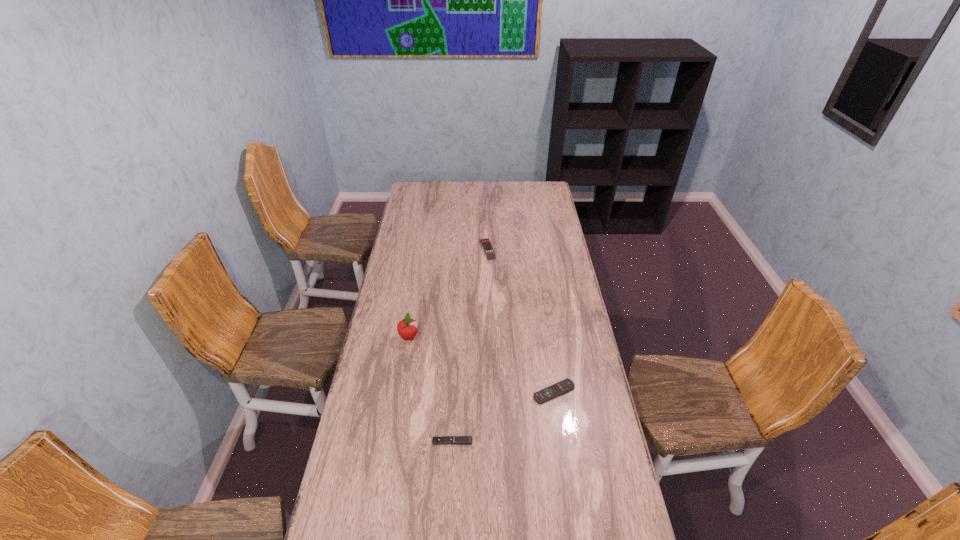
I want to click on the tallest object, so click(407, 328).

Locate an element on the screen. This screenshot has height=540, width=960. the second farthest object is located at coordinates (407, 328).

Identify the location of the farthest object. (485, 242).

At what (x,y) coordinates should I click in order to perform the action: click on the farthest remote control. Please return your answer as a coordinate pair (x, y). The width and height of the screenshot is (960, 540). Looking at the image, I should click on (485, 242).

Identify the location of the nearest remote control. This screenshot has width=960, height=540. (460, 440).

At what (x,y) coordinates should I click in order to perform the action: click on the second object from left to right. Please return your answer as a coordinate pair (x, y). The height and width of the screenshot is (540, 960). Looking at the image, I should click on [x=460, y=440].

The width and height of the screenshot is (960, 540). In order to click on the rightmost object in this screenshot , I will do `click(566, 385)`.

I want to click on the second nearest object, so click(566, 385).

You are a GUI agent. You are given a task and a screenshot of the screen. Output one action in this format:
    pyautogui.click(x=<x>, y=<y>)
    Task: Click on the vacant space positioned 0.180m on the back of the leftmost object
    The height and width of the screenshot is (540, 960).
    Given the screenshot: What is the action you would take?
    pyautogui.click(x=415, y=299)

Identify the location of vacant area situated 0.100m on the right of the second remote control from left to right. Image resolution: width=960 pixels, height=540 pixels. (516, 249).